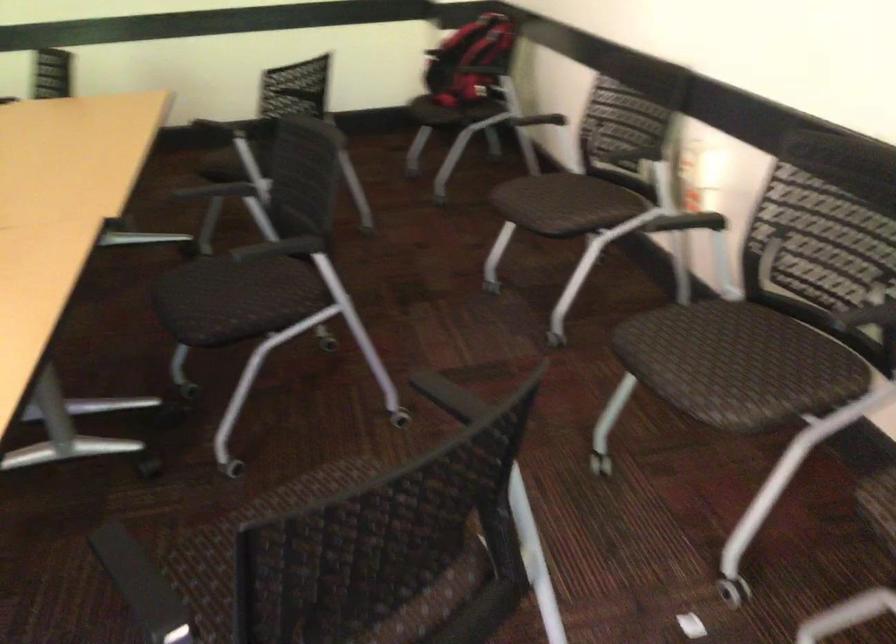
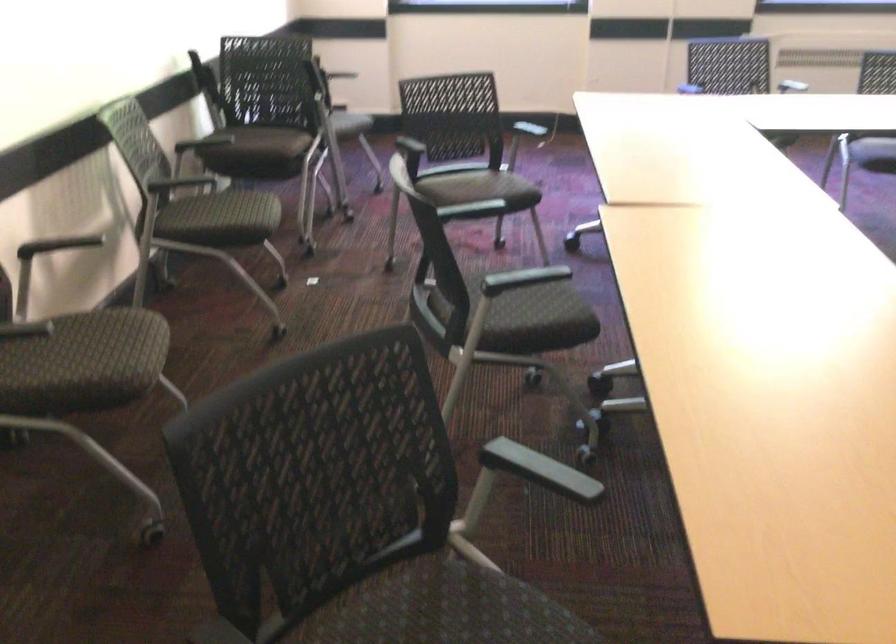
Question: I am providing you with two images of the same scene from different viewpoints. After the viewpoint changes to image2, which objects are now occluded?

Choices:
 (A) chair sitting surface
 (B) black chair armrest
 (C) chair armrest
 (D) red metal can

Answer: (C)